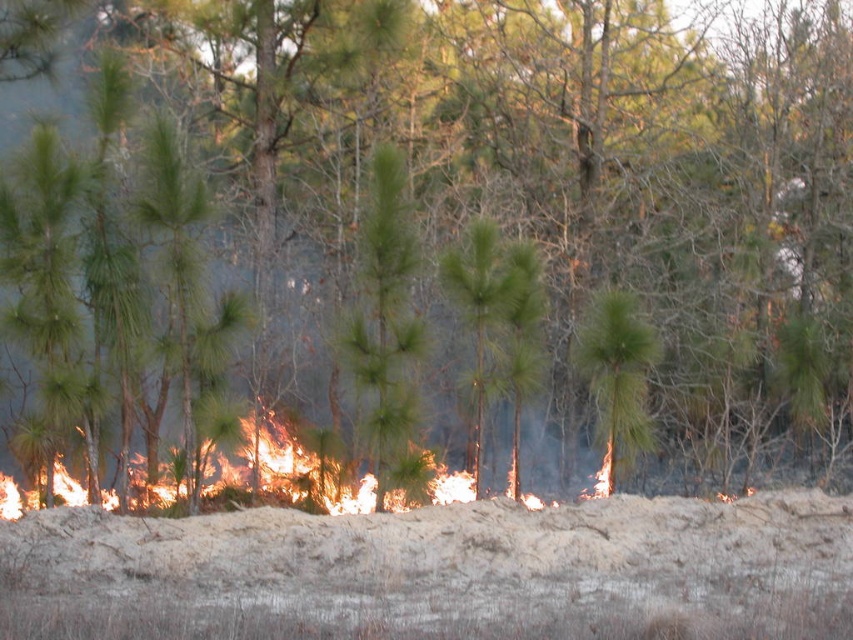
You are a firefighter assessing the fire damage in the forest. You notice a point of interest marked as point (387,328). What does this point represent?

The point (387,328) represents the location of the green needle leaves at the center of the image.